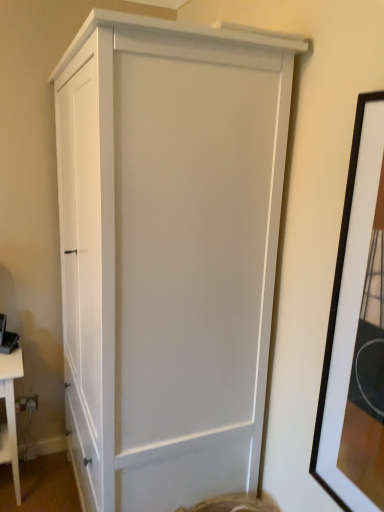
Question: Should I look upward or downward to see white matte cabinet at center?

Choices:
 (A) down
 (B) up

Answer: (A)

Question: Can we say white matte table at lower left lies outside black matte picture frame at right?

Choices:
 (A) yes
 (B) no

Answer: (A)

Question: Does white matte table at lower left lie behind black matte picture frame at right?

Choices:
 (A) yes
 (B) no

Answer: (A)

Question: From the image's perspective, is white matte table at lower left beneath black matte picture frame at right?

Choices:
 (A) no
 (B) yes

Answer: (B)

Question: Can you confirm if white matte table at lower left is taller than black matte picture frame at right?

Choices:
 (A) no
 (B) yes

Answer: (A)

Question: From the image's perspective, is white matte table at lower left above black matte picture frame at right?

Choices:
 (A) no
 (B) yes

Answer: (A)

Question: Is the surface of white matte table at lower left in direct contact with black matte picture frame at right?

Choices:
 (A) no
 (B) yes

Answer: (A)

Question: Is white matte table at lower left positioned behind white matte cabinet at center?

Choices:
 (A) no
 (B) yes

Answer: (B)

Question: Is white matte table at lower left taller than white matte cabinet at center?

Choices:
 (A) yes
 (B) no

Answer: (B)

Question: Can you confirm if white matte table at lower left is shorter than white matte cabinet at center?

Choices:
 (A) yes
 (B) no

Answer: (A)

Question: Is white matte table at lower left closer to camera compared to white matte cabinet at center?

Choices:
 (A) yes
 (B) no

Answer: (B)

Question: Is white matte table at lower left looking in the opposite direction of white matte cabinet at center?

Choices:
 (A) no
 (B) yes

Answer: (A)

Question: Can you confirm if white matte table at lower left is positioned to the right of white matte cabinet at center?

Choices:
 (A) no
 (B) yes

Answer: (A)

Question: From a real-world perspective, is black matte picture frame at right positioned under white matte table at lower left based on gravity?

Choices:
 (A) yes
 (B) no

Answer: (B)